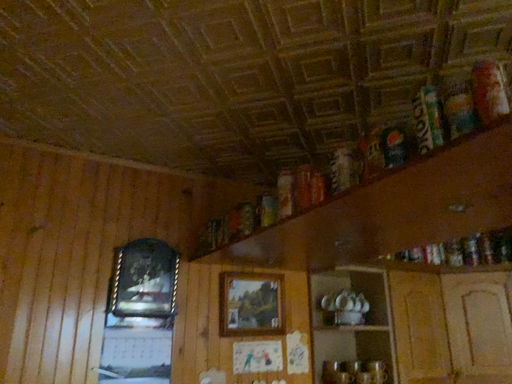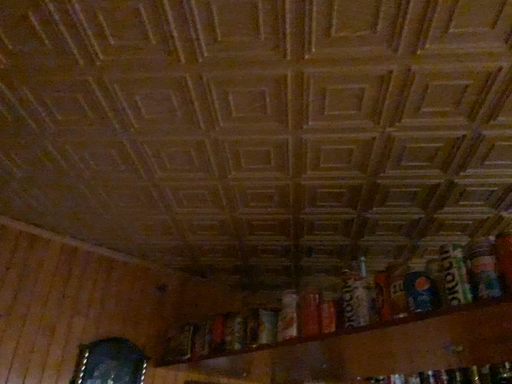
Question: Which way did the camera rotate in the video?

Choices:
 (A) rotated right
 (B) rotated left

Answer: (A)